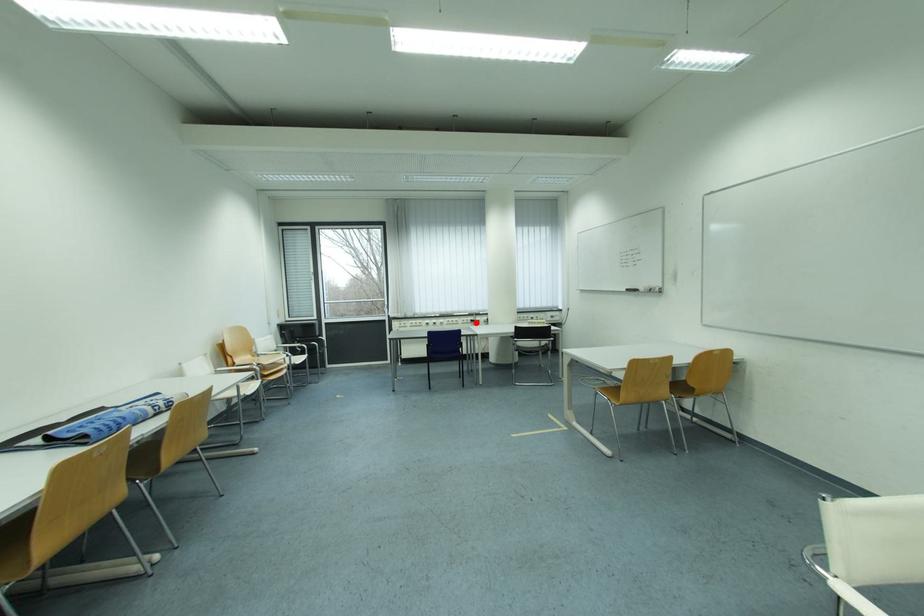
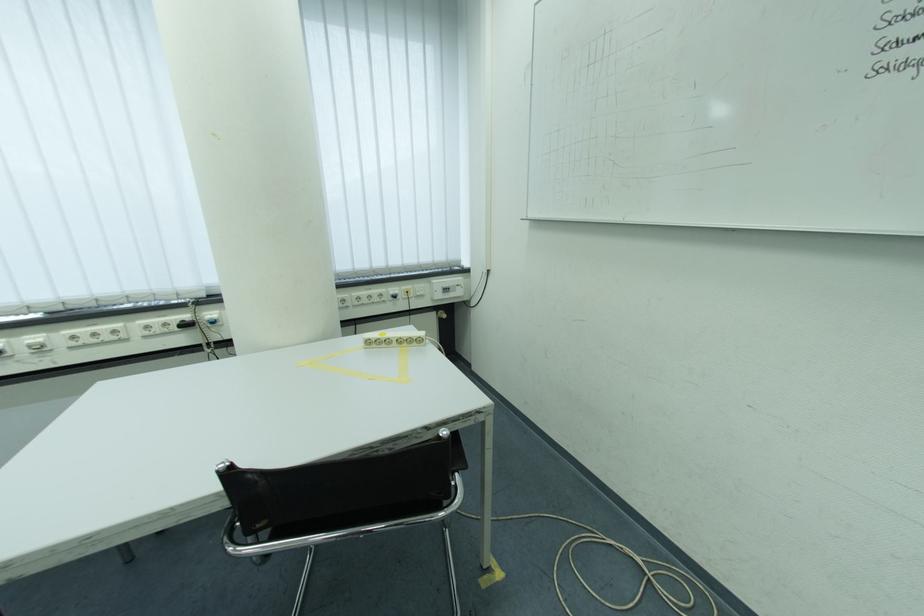
Locate, in the second image, the point that corresponds to the highlighted location in the first image.

(175, 326)